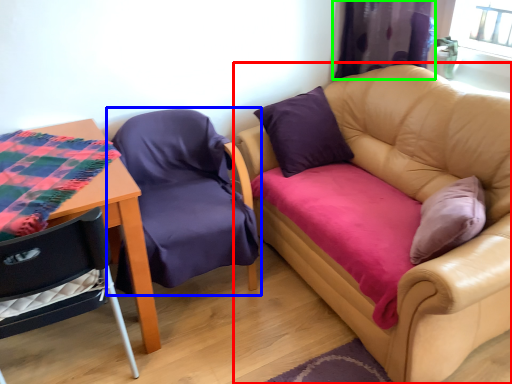
Question: Considering the real-world distances, which object is closest to studio couch (highlighted by a red box)? chair (highlighted by a blue box) or curtain (highlighted by a green box).

Choices:
 (A) chair
 (B) curtain

Answer: (B)